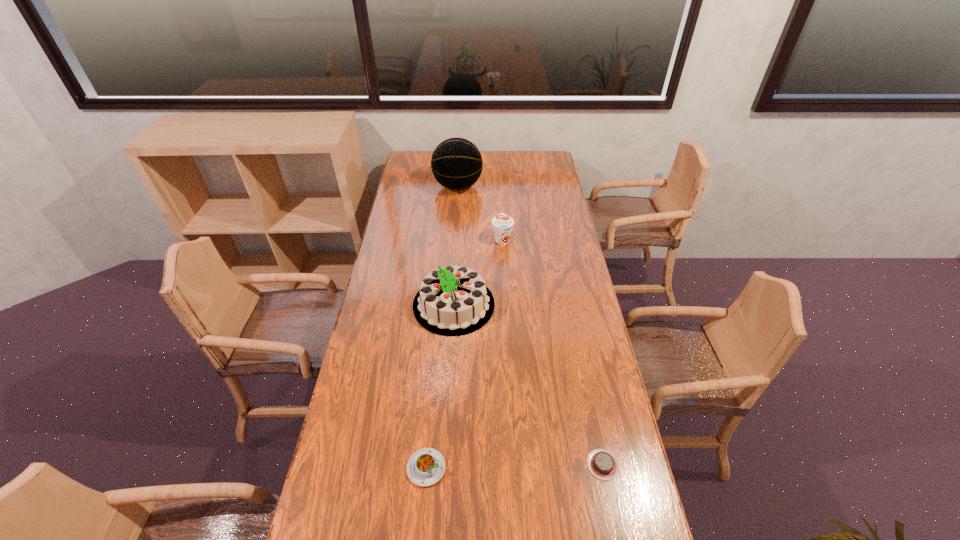
The width and height of the screenshot is (960, 540). Identify the location of vacant space that satisfies the following two spatial constraints: 1. on the back side of the second tallest object; 2. on the left side of the pudding. (441, 305).